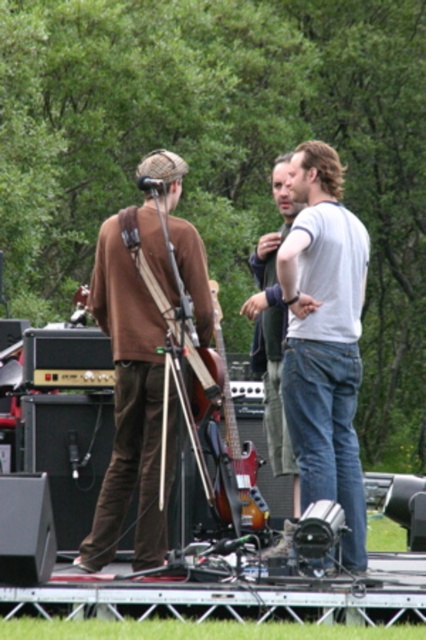
You are a photographer at the music event. You need to capture a photo where the brown suede shirt at left and denim jeans at center are both visible. Considering their heights, which object should be placed closer to the camera to ensure both are fully visible in the frame?

The brown suede shirt at left is shorter than the denim jeans at center. To ensure both are fully visible, position the brown suede shirt at left closer to the camera so its shorter height can be captured without being obscured by the taller denim jeans at center.